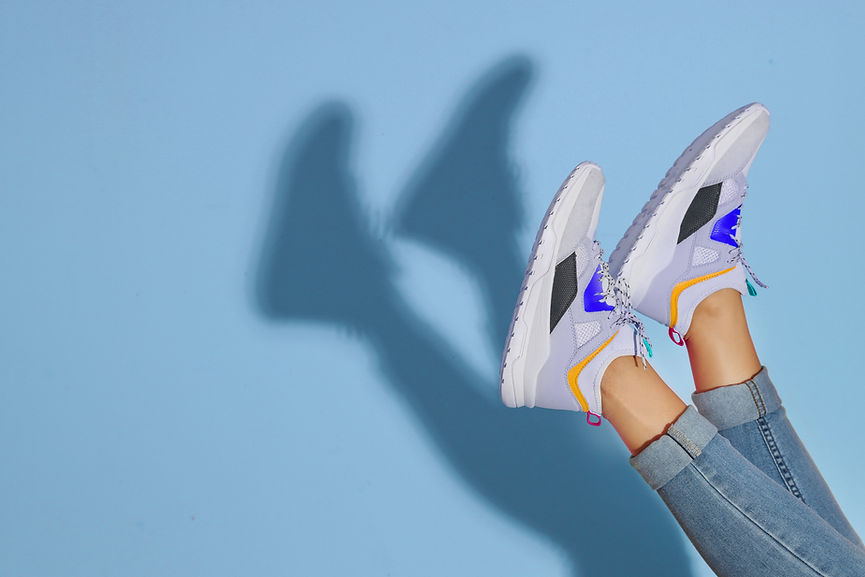
What are the coordinates of `blue shadows on wall` in the screenshot? It's located at (465, 206), (329, 247), (520, 482).